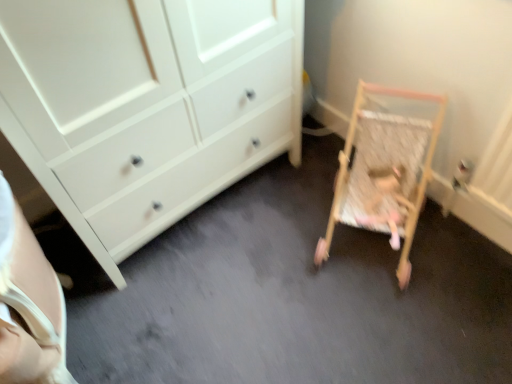
The image size is (512, 384). I want to click on unoccupied area behind wooden baby cot at lower right, so pos(311,172).